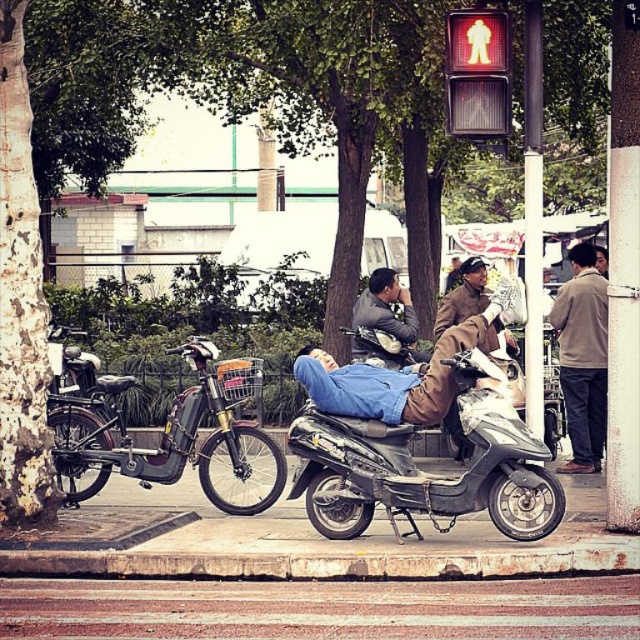
Question: Which point is farther to the camera?

Choices:
 (A) matte gray jacket at center
 (B) red glass pedestrian signal at upper right
 (C) metallic silver scooter at left
 (D) brown cotton jacket at right

Answer: (D)

Question: Can you confirm if paved asphalt road at lower center is wider than brown woolen coat at center?

Choices:
 (A) yes
 (B) no

Answer: (A)

Question: Is metallic silver scooter at left closer to camera compared to concrete at lower center?

Choices:
 (A) yes
 (B) no

Answer: (B)

Question: Considering the real-world distances, which object is closest to the brown leather jacket at center?

Choices:
 (A) concrete at lower center
 (B) red glass pedestrian signal at upper right

Answer: (B)

Question: Among these objects, which one is nearest to the camera?

Choices:
 (A) metallic silver scooter at left
 (B) concrete at lower center
 (C) paved asphalt road at lower center
 (D) metallic silver scooter at center

Answer: (C)

Question: Can you confirm if concrete at lower center is thinner than brown woolen coat at center?

Choices:
 (A) yes
 (B) no

Answer: (B)